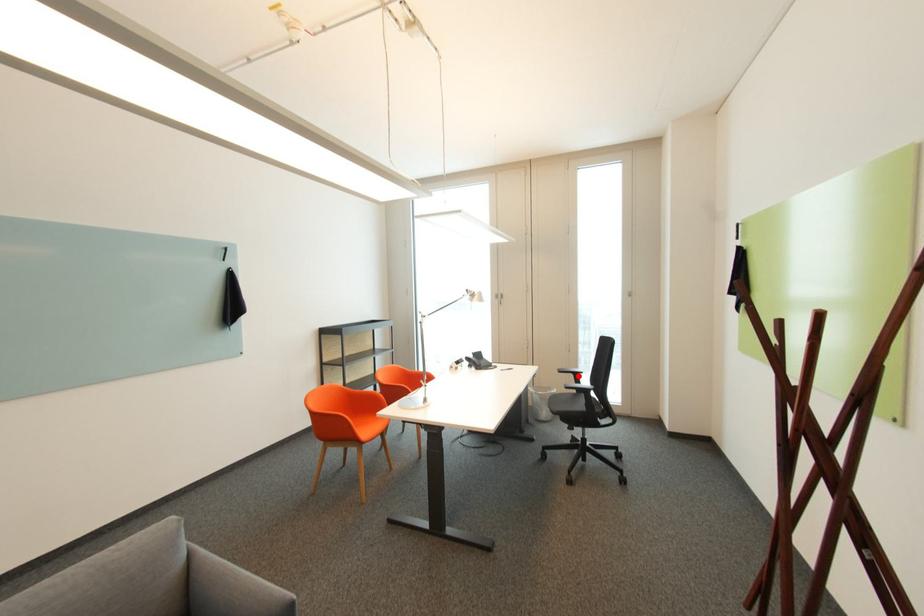
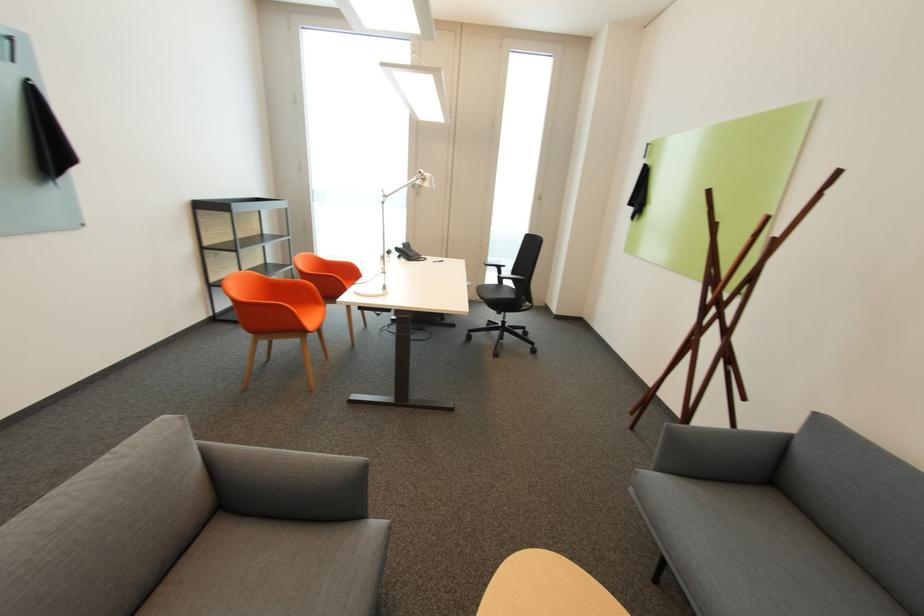
Question: I am providing you with two images of the same scene from different viewpoints. Image1 has a red point marked. In image2, the corresponding 3D location appears at what relative position? Reply with the corresponding letter.

Choices:
 (A) Closer
 (B) Farther

Answer: (A)